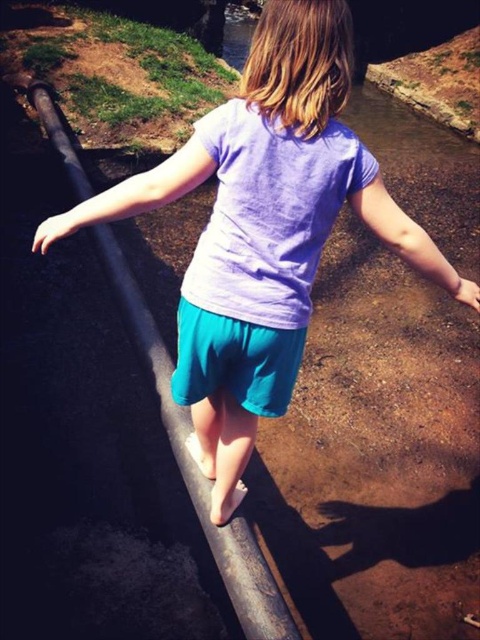
You are a parent watching your child walk on the smooth metal rail at center. You notice the teal fabric shorts at center. Where is the smooth metal rail in relation to the teal fabric shorts?

The smooth metal rail at center is located below the teal fabric shorts at center.

You are a parent watching your child walk on the smooth metal rail at center. You notice the teal fabric shorts at center. Which object is closer to the ground?

The smooth metal rail at center is closer to the ground since it has a lesser height compared to the teal fabric shorts at center.

You are a photographer trying to capture the child walking on the pipe. Based on the scene, which object should you focus on first to ensure the child is in focus? The smooth metal rail at center or the teal fabric shorts at center?

You should focus on the smooth metal rail at center first because it is closer to the viewer than the teal fabric shorts at center, ensuring the child is in focus.